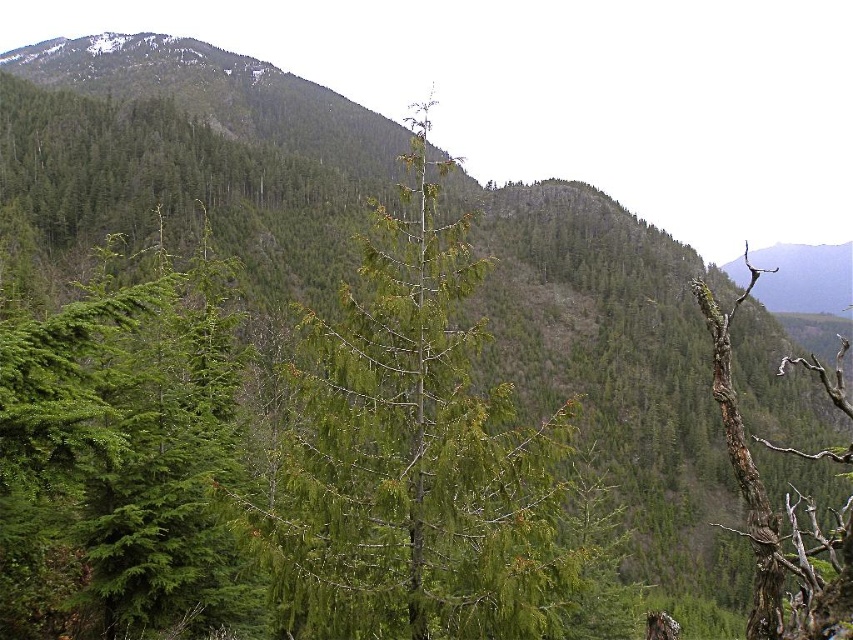
Does green needle-like tree at center have a smaller size compared to brown rough bark tree at right?

Correct, green needle-like tree at center occupies less space than brown rough bark tree at right.

Locate an element on the screen. The image size is (853, 640). green needle-like tree at center is located at coordinates (416, 456).

The image size is (853, 640). Find the location of `green needle-like tree at center`. green needle-like tree at center is located at coordinates (416, 456).

Which is above, green needle-like tree at center or green matte tree at left?

Positioned higher is green matte tree at left.

Is green needle-like tree at center shorter than green matte tree at left?

No.

Between point (422, 518) and point (231, 468), which one is positioned in front?

Point (422, 518) is more forward.

Identify the location of green needle-like tree at center. This screenshot has width=853, height=640. (416, 456).

Is point (173, 410) positioned behind point (811, 604)?

Yes, it is.

Is point (85, 384) closer to viewer compared to point (770, 515)?

No, it is not.

What do you see at coordinates (119, 452) in the screenshot? I see `green matte tree at left` at bounding box center [119, 452].

Identify the location of green matte tree at left. [119, 452].